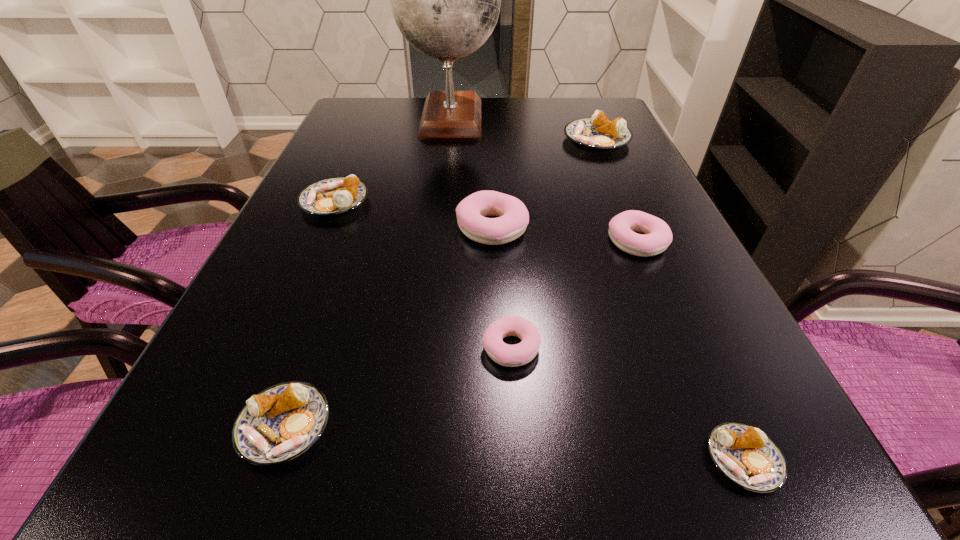
Identify the location of object present at the near edge. This screenshot has width=960, height=540. (746, 456).

This screenshot has height=540, width=960. I want to click on object at the far right corner, so point(599,133).

The image size is (960, 540). I want to click on object located in the near right corner section of the desktop, so click(746, 456).

In the image, there is a desktop. At what (x,y) coordinates should I click in order to perform the action: click on blank space at the near edge. Please return your answer as a coordinate pair (x, y). The image size is (960, 540). Looking at the image, I should click on (673, 490).

The image size is (960, 540). In order to click on free space at the left edge of the desktop in this screenshot , I will do `click(303, 274)`.

Image resolution: width=960 pixels, height=540 pixels. In order to click on vacant point at the right edge in this screenshot , I will do `click(597, 172)`.

The width and height of the screenshot is (960, 540). What are the coordinates of `vacant space at the far right corner of the desktop` in the screenshot? It's located at (566, 109).

At what (x,y) coordinates should I click in order to perform the action: click on unoccupied area between the sixth farthest object and the smallest brown pastry. Please return your answer as a coordinate pair (x, y). Looking at the image, I should click on (627, 403).

The image size is (960, 540). Identify the location of unoccupied area between the biggest brown pastry and the biggest pink pastry. (544, 184).

In order to click on free space between the nearest pink pastry and the third smallest brown pastry in this screenshot , I will do `click(422, 274)`.